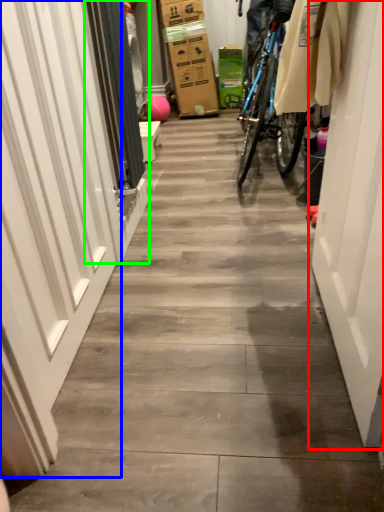
Question: Estimate the real-world distances between objects in this image. Which object is farther from door (highlighted by a red box), garage door (highlighted by a blue box) or screen door (highlighted by a green box)?

Choices:
 (A) garage door
 (B) screen door

Answer: (B)